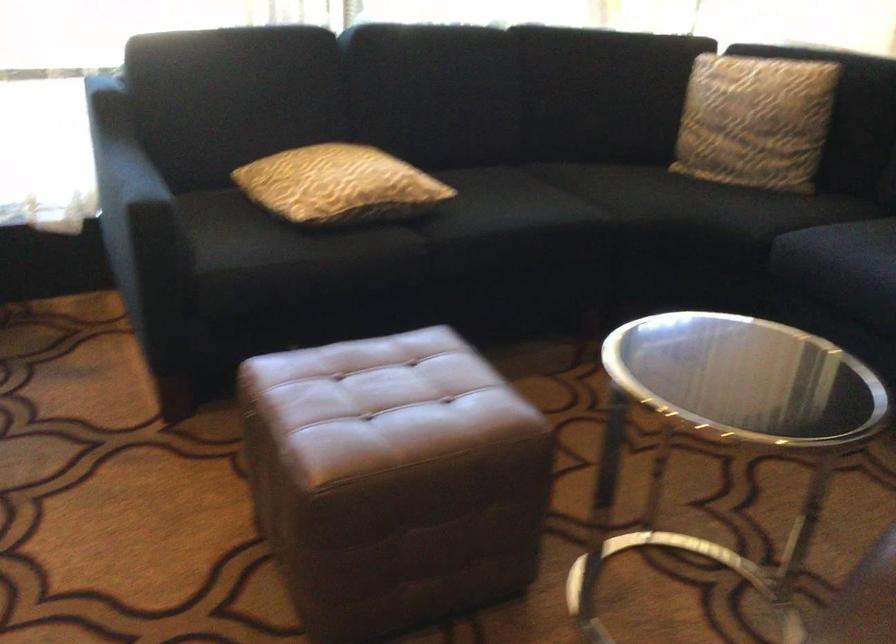
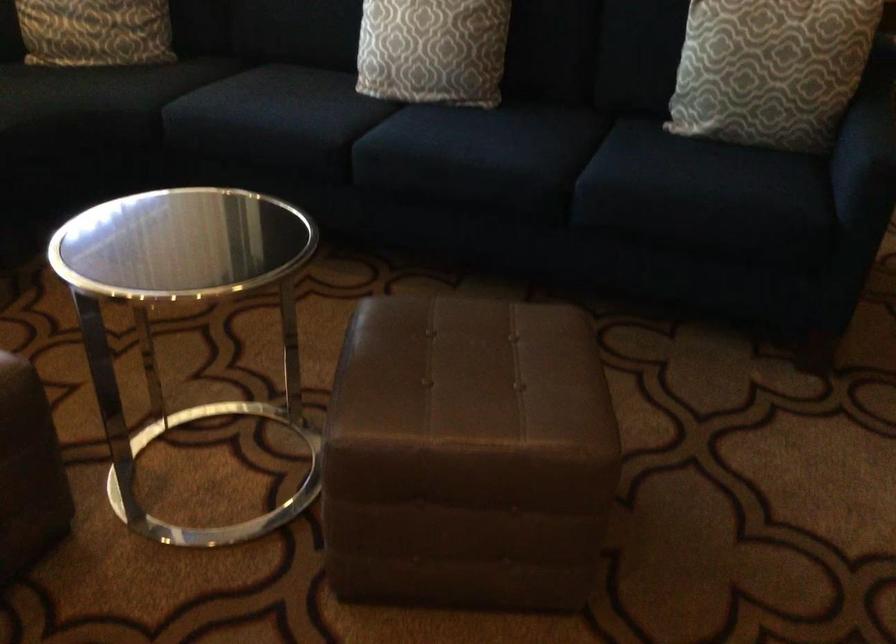
Question: Based on the continuous images, in which direction is the camera rotating? Reply with the corresponding letter.

Choices:
 (A) Left
 (B) Right
 (C) Up
 (D) Down

Answer: (B)